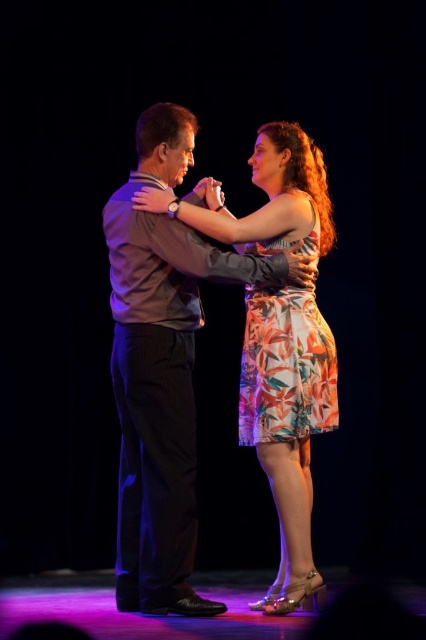
You are a photographer at the dance performance. You want to capture a closeup shot of the floral dress at center and the floral print dress at center. Which one should you focus on to ensure it appears larger in the photo?

The floral dress at center has a larger size compared to the floral print dress at center, so focusing on the floral dress at center will ensure it appears larger in the photo.

You are a photographer at the back of the stage. You see two dancers in the center wearing floral dress at center and floral print dress at center. Which one is positioned to the left?

The floral dress at center is positioned to the left of the floral print dress at center.